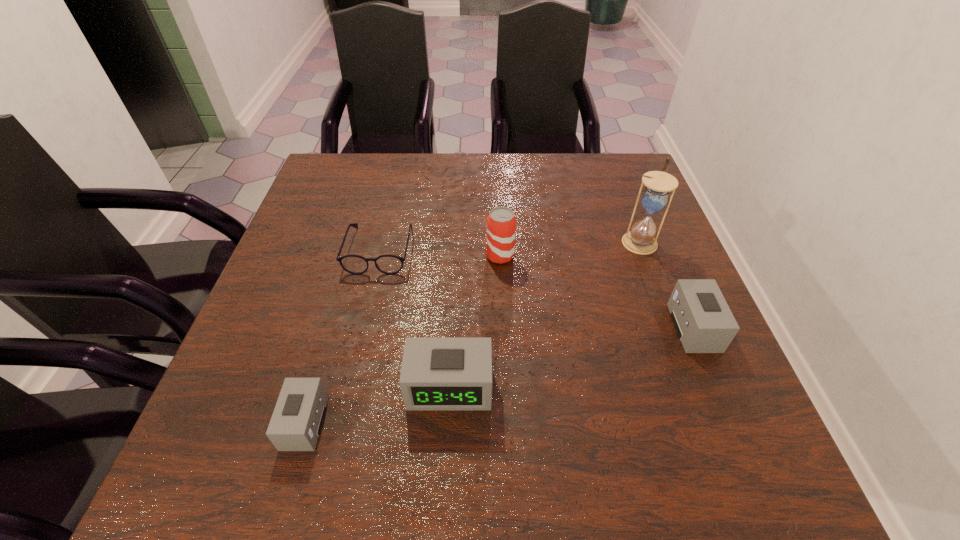
Locate an element on the screen. The image size is (960, 540). vacant region located 0.060m on the front-facing side of the shortest alarm clock is located at coordinates (252, 422).

Locate an element on the screen. The image size is (960, 540). free space located 0.100m on the front-facing side of the spectacles is located at coordinates (366, 309).

This screenshot has height=540, width=960. Identify the location of vacant space situated 0.360m on the left of the hourglass. (475, 241).

The height and width of the screenshot is (540, 960). Identify the location of vacant space located 0.080m on the front of the second tallest object. (501, 292).

Identify the location of alarm clock at the left edge. click(x=296, y=422).

Identify the location of spectacles positioned at the left edge. This screenshot has width=960, height=540. (388, 264).

Locate an element on the screen. The width and height of the screenshot is (960, 540). alarm clock at the right edge is located at coordinates (704, 323).

The image size is (960, 540). I want to click on hourglass present at the right edge, so click(641, 239).

This screenshot has height=540, width=960. I want to click on object positioned at the near left corner, so click(x=296, y=422).

Image resolution: width=960 pixels, height=540 pixels. What are the coordinates of `free space at the far edge` in the screenshot? It's located at [x=523, y=162].